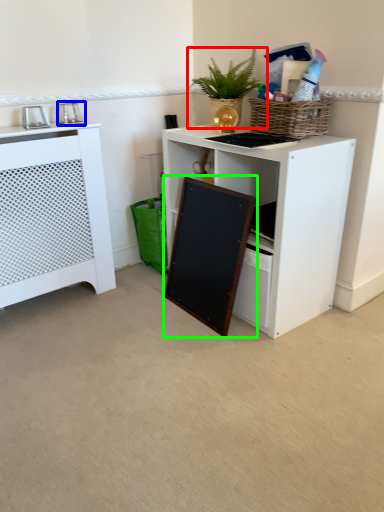
Question: Considering the real-world distances, which object is closest to houseplant (highlighted by a red box)? appliance (highlighted by a blue box) or screen door (highlighted by a green box).

Choices:
 (A) appliance
 (B) screen door

Answer: (B)